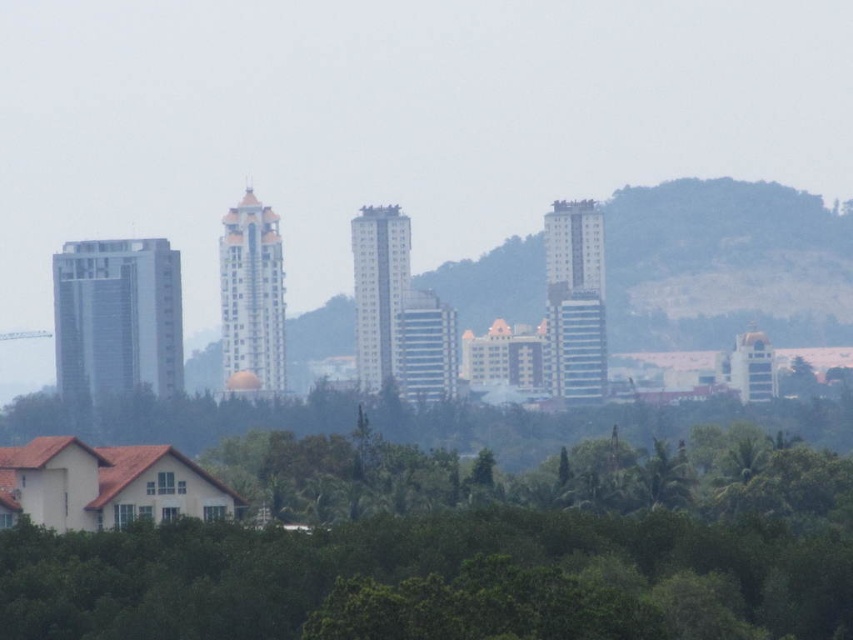
Based on the cityscape scene described, which object is shorter between the green leafy trees at lower center and the green grassy hillside at center?

The green leafy trees at lower center are shorter than the green grassy hillside at center.

You are a drone operator trying to capture a photo of the city skyline. You notice the green leafy trees at lower center and the green grassy hillside at center. Which object should you avoid obstructing the skyline view with?

You should avoid obstructing the skyline view with the green leafy trees at lower center because it is in front of the green grassy hillside at center, which might block the view of the taller buildings behind.

You are standing in the cityscape and want to determine which of the two points, point (x=230, y=545) or point (x=804, y=310), is closer to you. Based on the scene, which point is nearer?

Point (x=230, y=545) is closer to the viewer than point (x=804, y=310).